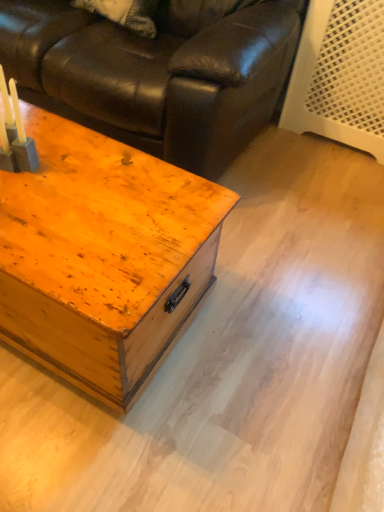
You are a GUI agent. You are given a task and a screenshot of the screen. Output one action in this format:
    pyautogui.click(x=<x>, y=<y>)
    Task: Click on the free point in front of matte gray candle holder at left
    The image size is (384, 512).
    Given the screenshot: What is the action you would take?
    pyautogui.click(x=25, y=209)